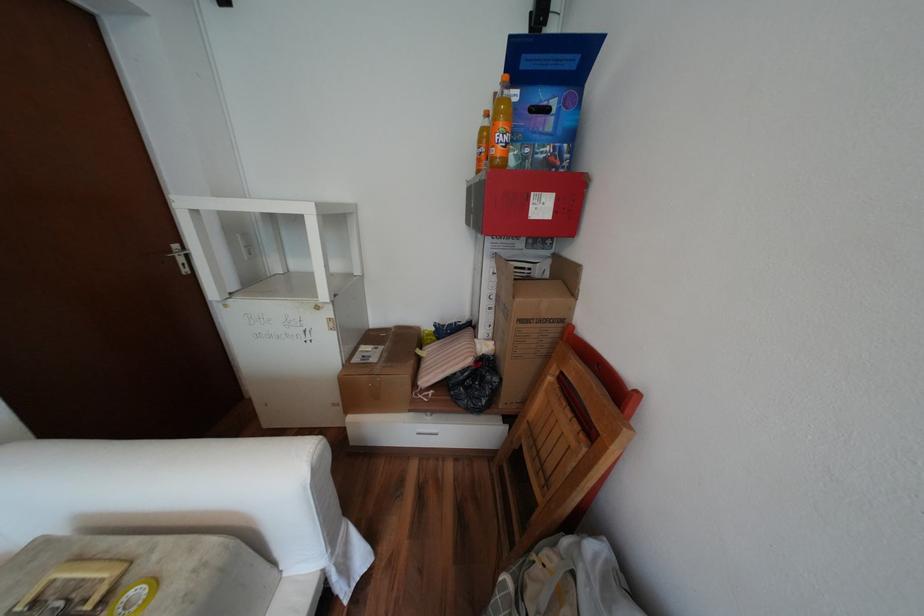
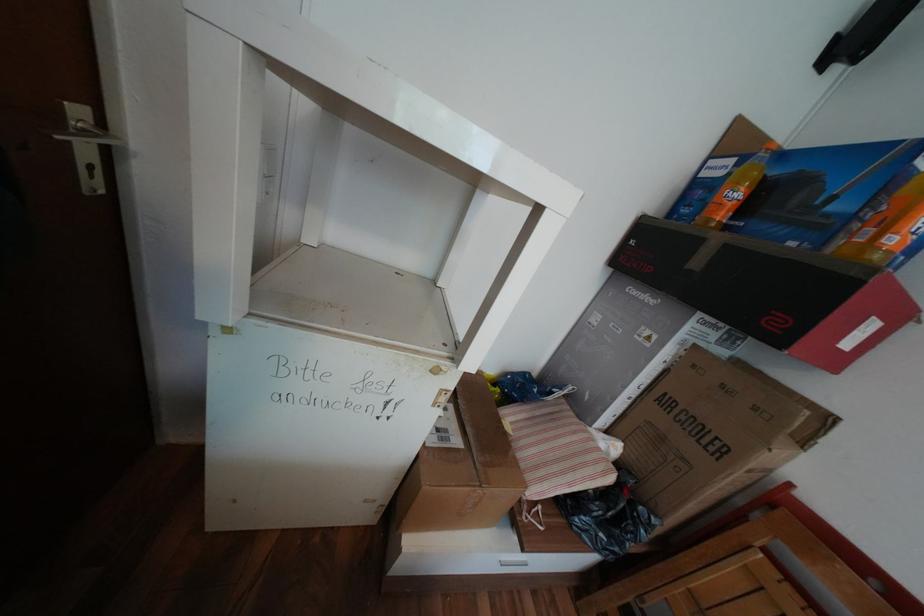
In a continuous first-person perspective shot, in which direction is the camera moving?

The cameraman moved toward left, forward.